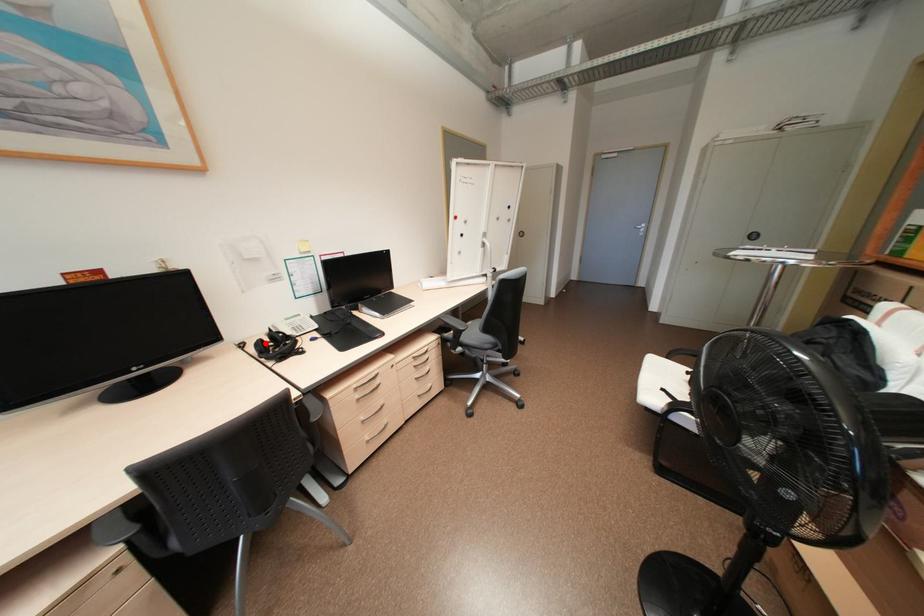
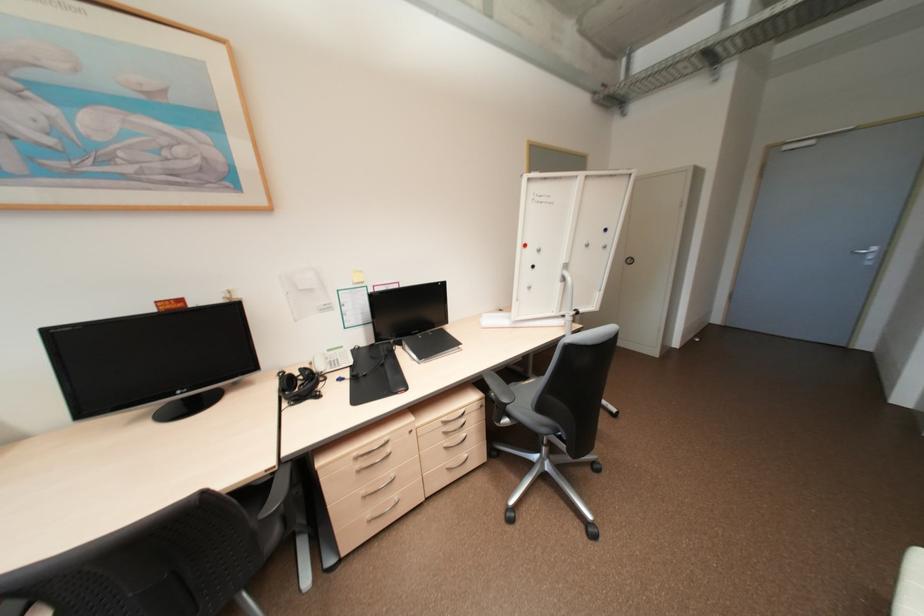
Locate, in the second image, the point that corresponds to the highlighted location in the first image.

(297, 377)